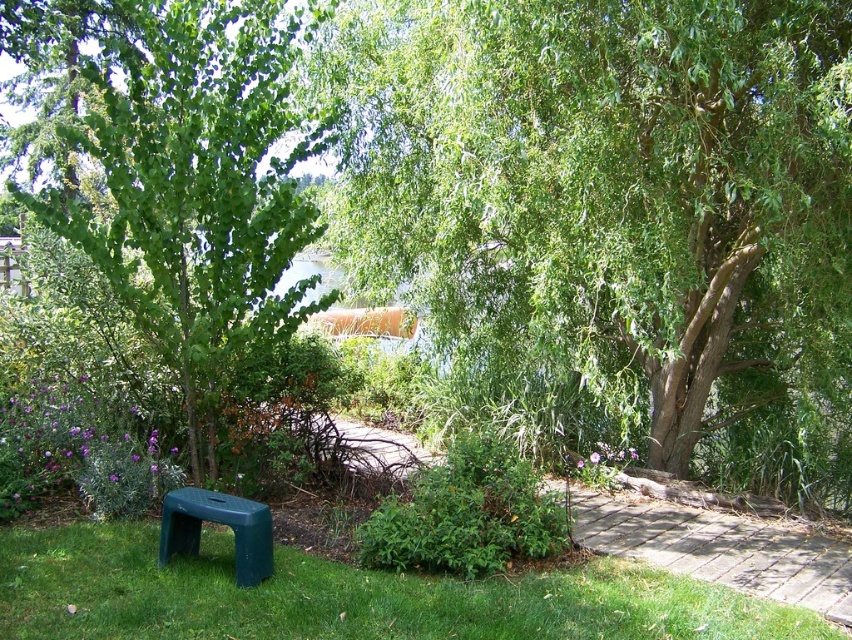
You are standing in the garden and want to walk to the brick paved path at center. Which direction should you walk to avoid the green leafy tree at left?

You should walk towards the right side to avoid the green leafy tree at left, as the brick paved path at center is behind the tree and likely extends to the right.